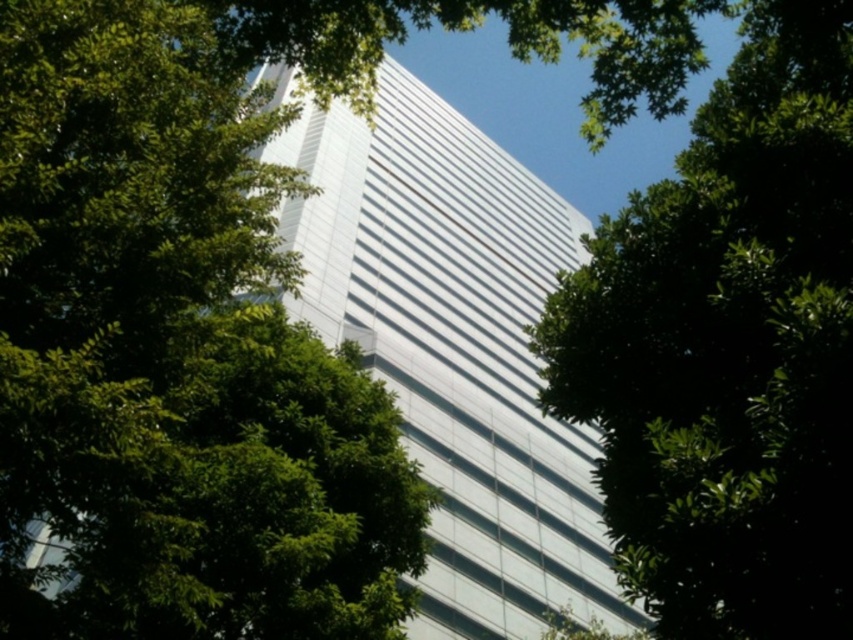
Question: Which point is farther to the camera?

Choices:
 (A) green leafy tree at center
 (B) white glass building at center

Answer: (B)

Question: Estimate the real-world distances between objects in this image. Which object is closer to the white glass building at center?

Choices:
 (A) green leafy tree at center
 (B) green leafy tree at upper left

Answer: (B)

Question: Is green leafy tree at upper left to the left of white glass building at center from the viewer's perspective?

Choices:
 (A) yes
 (B) no

Answer: (A)

Question: Considering the real-world distances, which object is closest to the white glass building at center?

Choices:
 (A) green leafy tree at upper left
 (B) green leafy tree at center

Answer: (A)

Question: Can you confirm if green leafy tree at center is positioned to the left of white glass building at center?

Choices:
 (A) yes
 (B) no

Answer: (B)

Question: Can you confirm if green leafy tree at center is bigger than white glass building at center?

Choices:
 (A) no
 (B) yes

Answer: (A)